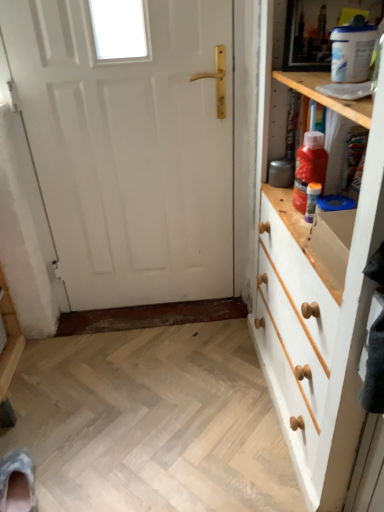
Question: Is translucent plastic bottle at upper right, which is counted as the first bottle, starting from the bottom, at the right side of red plastic bottle at upper right, the 2th bottle in the bottom-to-top sequence?

Choices:
 (A) yes
 (B) no

Answer: (A)

Question: From the image's perspective, is translucent plastic bottle at upper right, which is the second bottle from top to bottom, located above red plastic bottle at upper right, arranged as the first bottle when viewed from the top?

Choices:
 (A) yes
 (B) no

Answer: (B)

Question: Does translucent plastic bottle at upper right, which is counted as the first bottle, starting from the bottom, touch red plastic bottle at upper right, arranged as the first bottle when viewed from the top?

Choices:
 (A) yes
 (B) no

Answer: (A)

Question: Can you confirm if translucent plastic bottle at upper right, which is the second bottle from top to bottom, is thinner than red plastic bottle at upper right, arranged as the first bottle when viewed from the top?

Choices:
 (A) no
 (B) yes

Answer: (B)

Question: Is red plastic bottle at upper right, arranged as the first bottle when viewed from the top, surrounded by translucent plastic bottle at upper right, which is counted as the first bottle, starting from the bottom?

Choices:
 (A) no
 (B) yes

Answer: (A)

Question: Is translucent plastic bottle at upper right, which is the second bottle from top to bottom, smaller than red plastic bottle at upper right, the 2th bottle in the bottom-to-top sequence?

Choices:
 (A) yes
 (B) no

Answer: (A)

Question: Considering the relative positions of white matte door at center and white painted wood chest of drawers at right in the image provided, is white matte door at center to the left of white painted wood chest of drawers at right from the viewer's perspective?

Choices:
 (A) no
 (B) yes

Answer: (B)

Question: Is white matte door at center taller than white painted wood chest of drawers at right?

Choices:
 (A) no
 (B) yes

Answer: (B)

Question: Is white matte door at center closer to camera compared to white painted wood chest of drawers at right?

Choices:
 (A) yes
 (B) no

Answer: (B)

Question: Is white painted wood chest of drawers at right located within white matte door at center?

Choices:
 (A) no
 (B) yes

Answer: (A)

Question: Can you confirm if white matte door at center is smaller than white painted wood chest of drawers at right?

Choices:
 (A) no
 (B) yes

Answer: (B)

Question: Is white matte door at center behind white painted wood chest of drawers at right?

Choices:
 (A) yes
 (B) no

Answer: (A)

Question: Does red plastic bottle at upper right, the 2th bottle in the bottom-to-top sequence, touch camouflage fabric shoe at lower left?

Choices:
 (A) yes
 (B) no

Answer: (B)